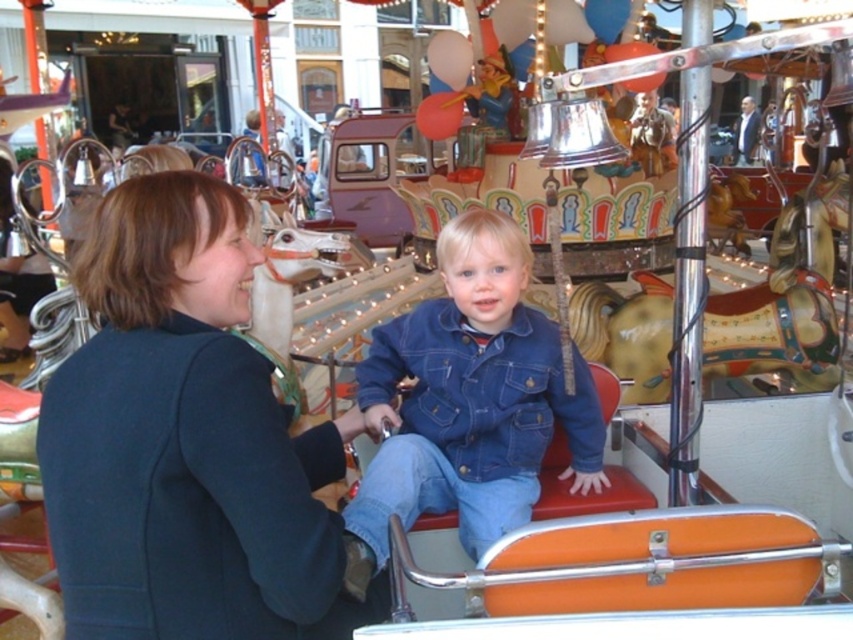
From the picture: Between dark blue jacket at center and denim jacket at center, which one appears on the left side from the viewer's perspective?

Positioned to the left is dark blue jacket at center.

Does dark blue jacket at center have a smaller size compared to denim jacket at center?

Yes, dark blue jacket at center is smaller than denim jacket at center.

What are the coordinates of `dark blue jacket at center` in the screenshot? It's located at (186, 442).

Where is `dark blue jacket at center`? The height and width of the screenshot is (640, 853). dark blue jacket at center is located at coordinates (186, 442).